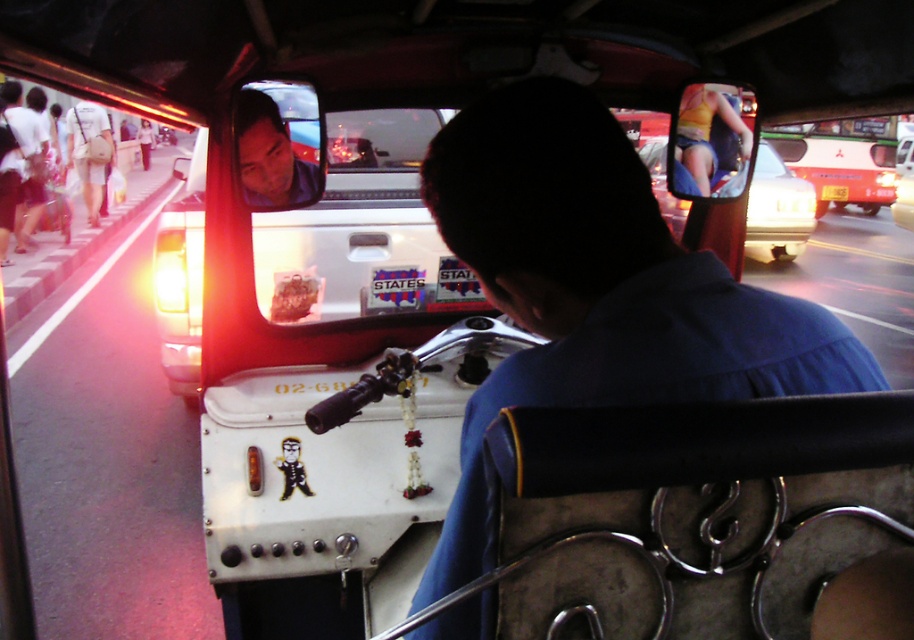
Question: Which of these objects is positioned farthest from the white fabric bag at left?

Choices:
 (A) matte plastic face at upper center
 (B) yellow fabric bikini at upper right
 (C) yellow plastic license plate at center

Answer: (C)

Question: Which point is closer to the camera?

Choices:
 (A) (143, 140)
 (B) (825, 196)

Answer: (B)

Question: From the image, what is the correct spatial relationship of yellow fabric bikini at upper right in relation to yellow plastic license plate at center?

Choices:
 (A) above
 (B) below

Answer: (B)

Question: Observing the image, what is the correct spatial positioning of matte plastic face at upper center in reference to yellow plastic license plate at center?

Choices:
 (A) below
 (B) above

Answer: (A)

Question: Among these points, which one is farthest from the camera?

Choices:
 (A) (92, 189)
 (B) (737, 106)
 (C) (280, 180)

Answer: (A)

Question: Is yellow fabric bikini at upper right closer to the viewer compared to white fabric bag at left?

Choices:
 (A) yes
 (B) no

Answer: (A)